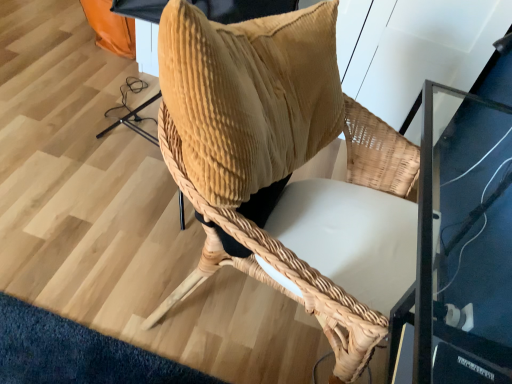
Identify the location of free space to the left of woven wood chair at center. This screenshot has height=384, width=512. (90, 277).